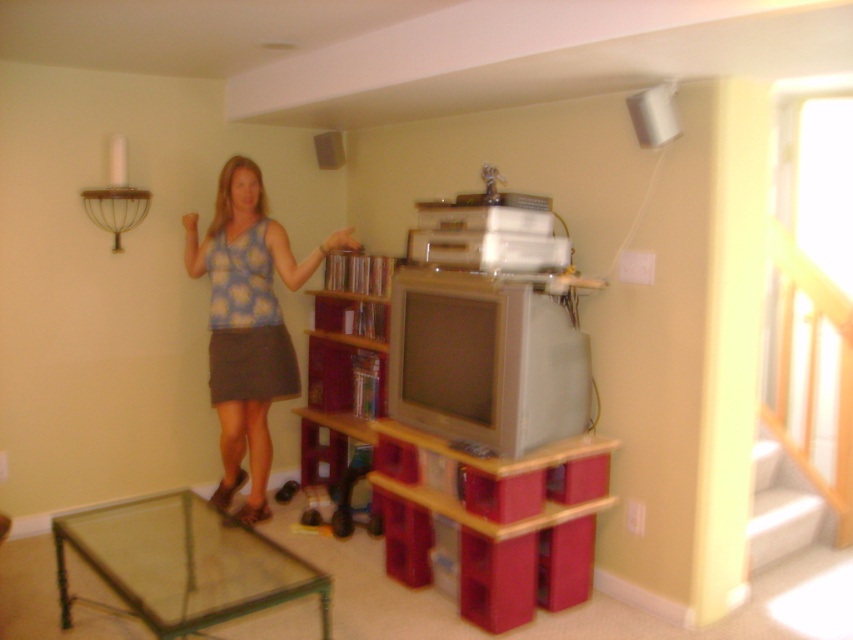
You are trying to place a large rectangular package on the transparent glass table at lower left and the wooden bookshelf at center. Which surface can accommodate the package based on their widths?

The transparent glass table at lower left has a larger width than the wooden bookshelf at center, so it can accommodate the large rectangular package.

You are a delivery person entering the living room and need to place a small package on the transparent glass table at lower left. However, you must avoid bumping into the blue floral tank top at center. Which direction should you move to reach the table without getting too close to the person?

The transparent glass table at lower left is positioned on the left side of blue floral tank top at center. To avoid getting too close to the person, you should move to the left side of the blue floral tank top at center to reach the transparent glass table at lower left.